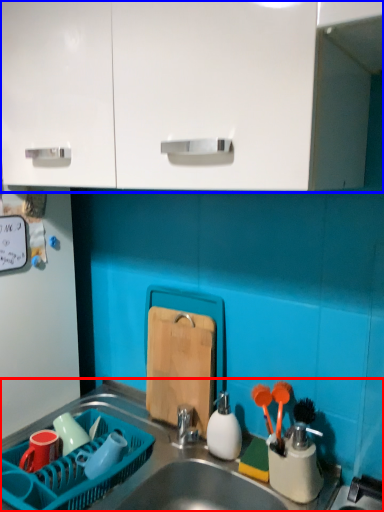
Question: Which object appears farthest to the camera in this image, sink (highlighted by a red box) or cabinetry (highlighted by a blue box)?

Choices:
 (A) sink
 (B) cabinetry

Answer: (A)